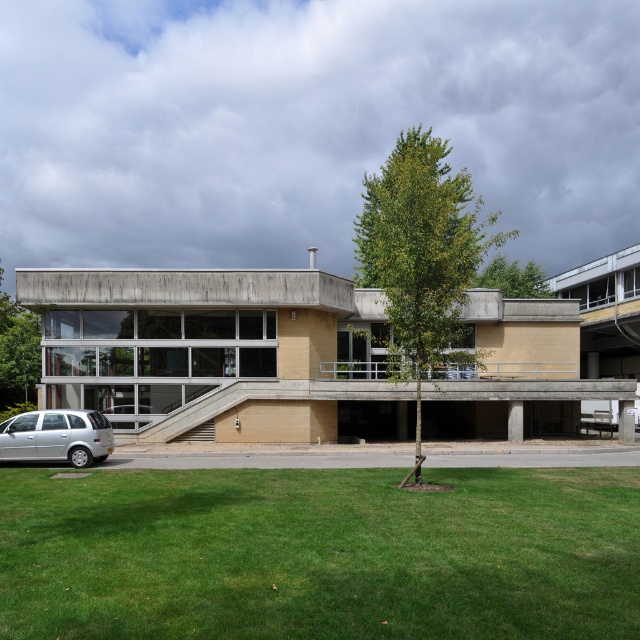
In the scene shown: You are a visitor arriving at the building and notice the green leafy tree at center and the silver metallic hatchback at lower left. Which object is bigger in size?

The green leafy tree at center is larger in size compared to the silver metallic hatchback at lower left.

You are a visitor arriving at the building and want to park your car. The green leafy tree at center and the silver metallic hatchback at lower left are in the parking area. Which object is taller, and why might this matter for parking?

The green leafy tree at center is much taller than the silver metallic hatchback at lower left. This matters for parking because the tree might obstruct the hatchback if parked too close, or block sunlight needed by the tree.